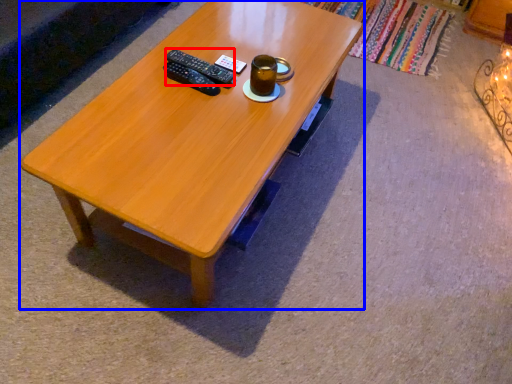
Question: Which object appears farthest to the camera in this image, remote (highlighted by a red box) or coffee table (highlighted by a blue box)?

Choices:
 (A) remote
 (B) coffee table

Answer: (A)